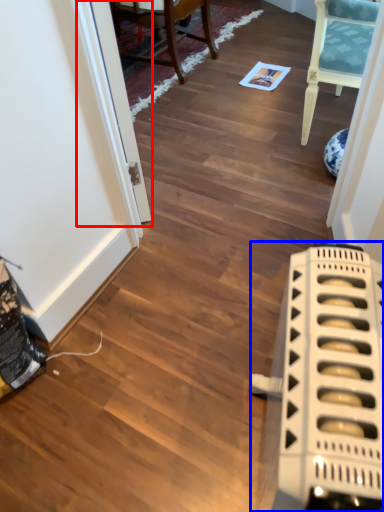
Question: Which point is closer to the camera, glass door (highlighted by a red box) or appliance (highlighted by a blue box)?

Choices:
 (A) glass door
 (B) appliance

Answer: (B)